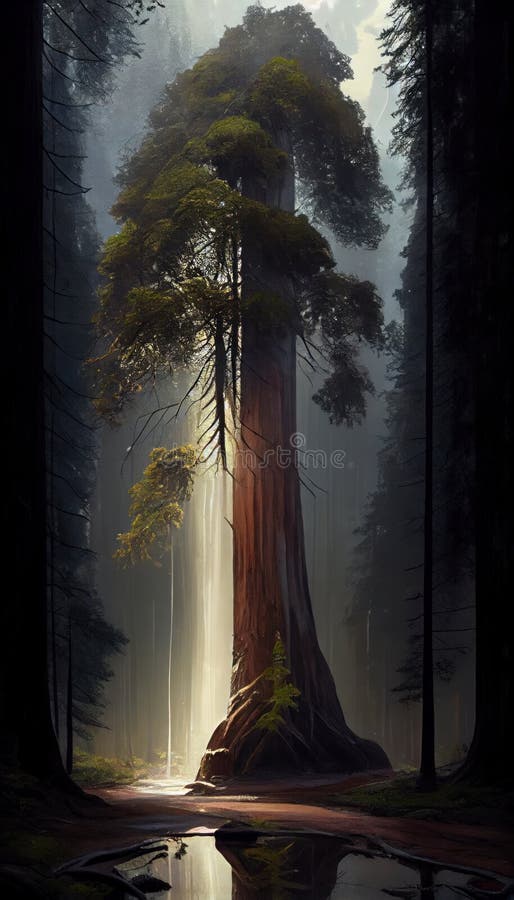
Where is `bright light shining down`? The image size is (514, 900). bright light shining down is located at coordinates (179, 780), (165, 779), (217, 655), (207, 499).